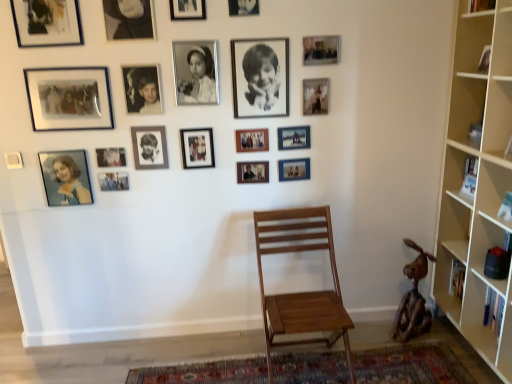
I want to click on wooden chair at center, so click(301, 292).

What is the approximate height of wooden chair at center?

It is 32.06 inches.

Where is `rustic wood sculpture at lower right`? The height and width of the screenshot is (384, 512). rustic wood sculpture at lower right is located at coordinates (413, 299).

At what (x,y) coordinates should I click in order to perform the action: click on matte wooden picture frame at center, the 16th picture frame positioned from the left. Please return your answer as a coordinate pair (x, y). Image resolution: width=512 pixels, height=384 pixels. Looking at the image, I should click on (293, 137).

Image resolution: width=512 pixels, height=384 pixels. What are the coordinates of `matte black photo frame at center left, the 4th picture frame in the left-to-right sequence` in the screenshot? It's located at (110, 157).

Is black matte photo frame at center, placed as the fifteenth picture frame when sorted from left to right, bigger than metallic silver photo frame at upper right, the 18th picture frame positioned from the left?

Correct, black matte photo frame at center, placed as the fifteenth picture frame when sorted from left to right, is larger in size than metallic silver photo frame at upper right, the 18th picture frame positioned from the left.

From the image's perspective, is black matte photo frame at center, the fifth picture frame from the right, on top of metallic silver photo frame at upper right, the second picture frame viewed from the right?

Yes, from the image's perspective, black matte photo frame at center, the fifth picture frame from the right, is over metallic silver photo frame at upper right, the second picture frame viewed from the right.

From a real-world perspective, which object rests below the other?

metallic silver photo frame at upper right, the second picture frame viewed from the right.

This screenshot has width=512, height=384. What are the coordinates of `picture frame that is the 3rd object located behind the black matte photo frame at center, the fifth picture frame from the right` in the screenshot? It's located at (316, 96).

How many degrees apart are the facing directions of rustic wood sculpture at lower right and metallic silver photo frame at upper right, the 18th picture frame positioned from the left?

There is a 91.1-degree angle between the facing directions of rustic wood sculpture at lower right and metallic silver photo frame at upper right, the 18th picture frame positioned from the left.

Where is `picture frame that is the 10th one above the rustic wood sculpture at lower right (from a real-world perspective)`? This screenshot has width=512, height=384. picture frame that is the 10th one above the rustic wood sculpture at lower right (from a real-world perspective) is located at coordinates (316, 96).

Is rustic wood sculpture at lower right closer to the viewer compared to metallic silver photo frame at upper right, the second picture frame viewed from the right?

No, it is not.

Is rustic wood sculpture at lower right bigger than metallic silver photo frame at upper right, the 18th picture frame positioned from the left?

Yes.

In the scene shown: From the image's perspective, which one is positioned lower, metallic silver photo frame at upper center, which is the ninth picture frame from left to right, or matte black photo frame at lower left, the 15th picture frame from the right?

matte black photo frame at lower left, the 15th picture frame from the right.

Is metallic silver photo frame at upper center, the 11th picture frame positioned from the right, next to matte black photo frame at lower left, arranged as the 5th picture frame when viewed from the left, and touching it?

There is a gap between metallic silver photo frame at upper center, the 11th picture frame positioned from the right, and matte black photo frame at lower left, arranged as the 5th picture frame when viewed from the left.

Based on the photo, is metallic silver photo frame at upper center, which is the ninth picture frame from left to right, to the right of matte black photo frame at lower left, arranged as the 5th picture frame when viewed from the left, from the viewer's perspective?

Yes, metallic silver photo frame at upper center, which is the ninth picture frame from left to right, is to the right of matte black photo frame at lower left, arranged as the 5th picture frame when viewed from the left.

Can you confirm if matte black photo frame at center left, which appears as the sixteenth picture frame when viewed from the right, is thinner than black matte photo frame at upper center, the seventh picture frame positioned from the left?

Yes.

Is matte black photo frame at center left, which appears as the sixteenth picture frame when viewed from the right, aimed at black matte photo frame at upper center, which is the 13th picture frame in right-to-left order?

No, matte black photo frame at center left, which appears as the sixteenth picture frame when viewed from the right, is not oriented towards black matte photo frame at upper center, which is the 13th picture frame in right-to-left order.

Looking at this image, how different are the orientations of matte black photo frame at center left, which appears as the sixteenth picture frame when viewed from the right, and black matte photo frame at upper center, the seventh picture frame positioned from the left, in degrees?

The angle between the facing direction of matte black photo frame at center left, which appears as the sixteenth picture frame when viewed from the right, and the facing direction of black matte photo frame at upper center, the seventh picture frame positioned from the left, is 0.0211 degrees.

Is matte black photo frame at center left, which appears as the sixteenth picture frame when viewed from the right, shorter than black matte photo frame at upper center, which is the 13th picture frame in right-to-left order?

Correct, matte black photo frame at center left, which appears as the sixteenth picture frame when viewed from the right, is not as tall as black matte photo frame at upper center, which is the 13th picture frame in right-to-left order.

Considering the positions of points (45, 25) and (151, 111), is point (45, 25) farther from camera compared to point (151, 111)?

No, it is in front of (151, 111).

Does matte black photo frame at upper left, which is the nineteenth picture frame in right-to-left order, have a lesser height compared to black matte photo frame at upper center, which is the 13th picture frame in right-to-left order?

In fact, matte black photo frame at upper left, which is the nineteenth picture frame in right-to-left order, may be taller than black matte photo frame at upper center, which is the 13th picture frame in right-to-left order.

Considering their positions, is matte black photo frame at upper left, arranged as the 1th picture frame when viewed from the left, located in front of or behind black matte photo frame at upper center, the seventh picture frame positioned from the left?

Clearly, matte black photo frame at upper left, arranged as the 1th picture frame when viewed from the left, is in front of black matte photo frame at upper center, the seventh picture frame positioned from the left.

Can you see light wood bookcase at right touching matte black photo frame at upper left, arranged as the 1th picture frame when viewed from the left?

There is a gap between light wood bookcase at right and matte black photo frame at upper left, arranged as the 1th picture frame when viewed from the left.

Does light wood bookcase at right turn towards matte black photo frame at upper left, which is the nineteenth picture frame in right-to-left order?

Yes, light wood bookcase at right is aimed at matte black photo frame at upper left, which is the nineteenth picture frame in right-to-left order.

Is light wood bookcase at right taller or shorter than matte black photo frame at upper left, arranged as the 1th picture frame when viewed from the left?

Considering their sizes, light wood bookcase at right has more height than matte black photo frame at upper left, arranged as the 1th picture frame when viewed from the left.

Is light wood bookcase at right at the left side of matte black photo frame at upper left, which is the nineteenth picture frame in right-to-left order?

No, light wood bookcase at right is not to the left of matte black photo frame at upper left, which is the nineteenth picture frame in right-to-left order.

Is matte wooden picture frame at center, which is the third picture frame in right-to-left order, not within black matte photo frame at upper center, which ranks as the 8th picture frame in left-to-right order?

matte wooden picture frame at center, which is the third picture frame in right-to-left order, lies outside black matte photo frame at upper center, which ranks as the 8th picture frame in left-to-right order,'s area.

Which of these two, matte wooden picture frame at center, which is the third picture frame in right-to-left order, or black matte photo frame at upper center, the 12th picture frame viewed from the right, is smaller?

Smaller between the two is matte wooden picture frame at center, which is the third picture frame in right-to-left order.

Does matte wooden picture frame at center, arranged as the seventeenth picture frame when viewed from the left, lie in front of black matte photo frame at upper center, the 12th picture frame viewed from the right?

No, matte wooden picture frame at center, arranged as the seventeenth picture frame when viewed from the left, is further to the viewer.

From a real-world perspective, which is physically above, matte wooden picture frame at center, arranged as the seventeenth picture frame when viewed from the left, or black matte photo frame at upper center, which ranks as the 8th picture frame in left-to-right order?

black matte photo frame at upper center, which ranks as the 8th picture frame in left-to-right order.

This screenshot has height=384, width=512. Find the location of `the 2nd picture frame positioned above the metallic silver photo frame at upper right, the second picture frame viewed from the right (from the image's perspective)`. the 2nd picture frame positioned above the metallic silver photo frame at upper right, the second picture frame viewed from the right (from the image's perspective) is located at coordinates (260, 77).

Identify the location of sculpture below the metallic silver photo frame at upper right, the second picture frame viewed from the right (from the image's perspective). This screenshot has width=512, height=384. (413, 299).

Looking at the image, which one is located closer to black matte photo frame at upper center, the seventh picture frame positioned from the left, rustic wood sculpture at lower right or matte wooden picture frame at center, which is the third picture frame in right-to-left order?

matte wooden picture frame at center, which is the third picture frame in right-to-left order.

In the scene shown: From the image, which object appears to be farther from black matte photo frame at upper center, which appears as the 6th picture frame when viewed from the left, rustic wood sculpture at lower right or matte black photo frame at center left, the 4th picture frame in the left-to-right sequence?

rustic wood sculpture at lower right lies further to black matte photo frame at upper center, which appears as the 6th picture frame when viewed from the left, than the other object.

From the image, which object appears to be farther from light wood bookcase at right, matte wooden picture frame at center, arranged as the seventeenth picture frame when viewed from the left, or rustic wood sculpture at lower right?

matte wooden picture frame at center, arranged as the seventeenth picture frame when viewed from the left, lies further to light wood bookcase at right than the other object.

In the scene shown: Looking at the image, which one is located further to matte black photo frame at upper left, arranged as the 1th picture frame when viewed from the left, carpeted mat at center or metallic photo frame at upper right, which ranks as the first picture frame in right-to-left order?

carpeted mat at center is positioned further to the anchor matte black photo frame at upper left, arranged as the 1th picture frame when viewed from the left.

When comparing their distances from metallic silver photo frame at upper right, the second picture frame viewed from the right, does metallic silver photo frame at upper center, which is the twelfth picture frame from left to right, or matte black picture frame at center, which is the tenth picture frame in left-to-right order, seem closer?

Based on the image, metallic silver photo frame at upper center, which is the twelfth picture frame from left to right, appears to be nearer to metallic silver photo frame at upper right, the second picture frame viewed from the right.

Based on their spatial positions, is matte black photo frame at lower left, the 15th picture frame from the right, or black matte photo frame at upper center, which ranks as the 8th picture frame in left-to-right order, closer to carpeted mat at center?

black matte photo frame at upper center, which ranks as the 8th picture frame in left-to-right order.

Estimate the real-world distances between objects in this image. Which object is closer to black matte photo frame at center, placed as the fifteenth picture frame when sorted from left to right, matte black photo frame at lower left, the 15th picture frame from the right, or wooden photo frame at center, positioned as the 7th picture frame in right-to-left order?

wooden photo frame at center, positioned as the 7th picture frame in right-to-left order, is positioned closer to the anchor black matte photo frame at center, placed as the fifteenth picture frame when sorted from left to right.

Considering their positions, is metallic silver photo frame at upper right, the second picture frame viewed from the right, positioned further to matte black photo frame at upper left, which is the nineteenth picture frame in right-to-left order, than wooden photo frame at center, the thirteenth picture frame in the left-to-right sequence?

Among the two, metallic silver photo frame at upper right, the second picture frame viewed from the right, is located further to matte black photo frame at upper left, which is the nineteenth picture frame in right-to-left order.

The height and width of the screenshot is (384, 512). I want to click on chair between wooden photo frame at center, the thirteenth picture frame in the left-to-right sequence, and carpeted mat at center from top to bottom, so click(x=301, y=292).

At what (x,y) coordinates should I click in order to perform the action: click on chair between matte black photo frame at lower left, arranged as the 5th picture frame when viewed from the left, and metallic silver photo frame at upper right, the 18th picture frame positioned from the left, from left to right. Please return your answer as a coordinate pair (x, y). Looking at the image, I should click on (301, 292).

Find the location of a particular element. This screenshot has height=384, width=512. mat between matte black photo frame at lower left, arranged as the 5th picture frame when viewed from the left, and light wood bookcase at right from left to right is located at coordinates (410, 365).

In order to click on chair that lies between black matte photo frame at upper center, which ranks as the 8th picture frame in left-to-right order, and carpeted mat at center from top to bottom in this screenshot , I will do `click(301, 292)`.